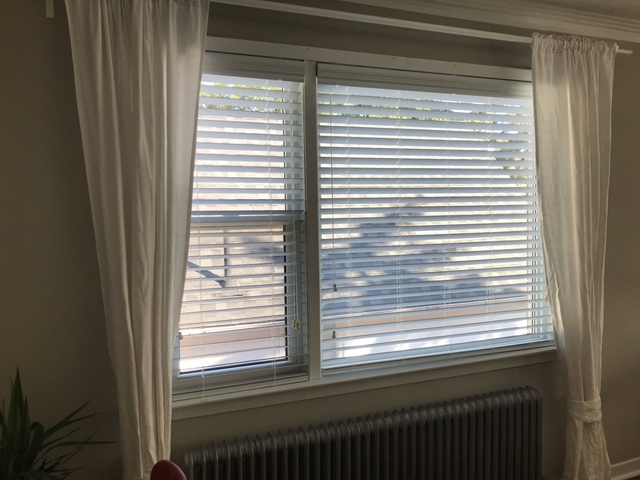
At what (x,y) coordinates should I click in order to perform the action: click on window blinds. Please return your answer as a coordinate pair (x, y). The image size is (640, 480). Looking at the image, I should click on (378, 192), (246, 191), (236, 245).